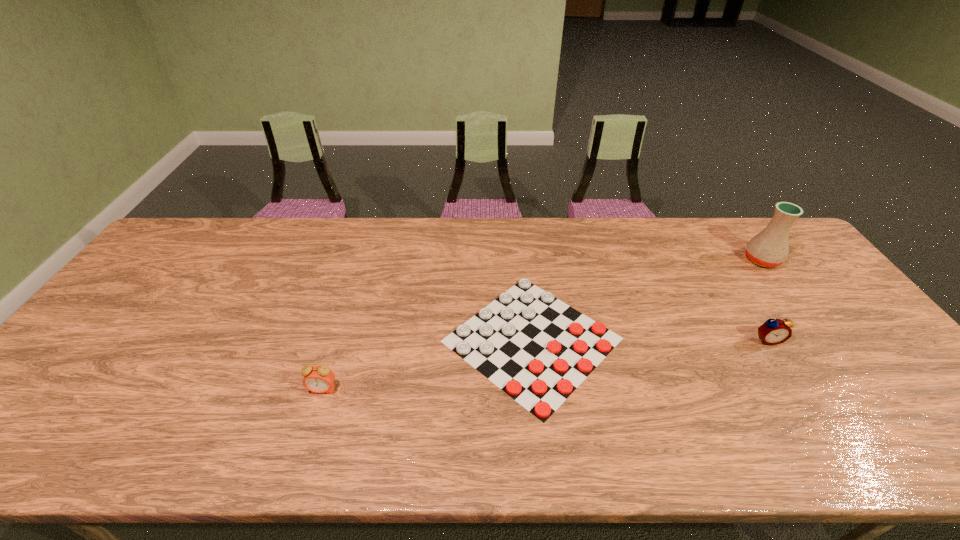
Find the location of a particular element. The image size is (960, 540). the second closest object to the left alarm clock is located at coordinates (773, 331).

Locate which object is the third closest to the shortest object. Please provide its 2D coordinates. Your answer should be formatted as a tuple, i.e. [(x, y)], where the tuple contains the x and y coordinates of a point satisfying the conditions above.

[(769, 248)]